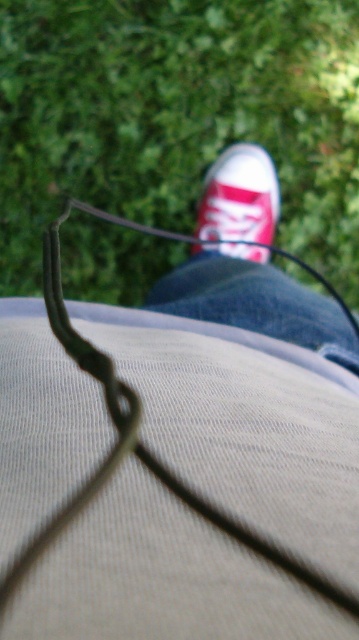
Question: Does green grass at upper center have a lesser width compared to matte canvas shoe at center?

Choices:
 (A) yes
 (B) no

Answer: (B)

Question: Which point is farther to the camera?

Choices:
 (A) matte canvas shoe at center
 (B) green grass at upper center

Answer: (B)

Question: From the image, what is the correct spatial relationship of green grass at upper center in relation to matte canvas shoe at center?

Choices:
 (A) left
 (B) right

Answer: (A)

Question: Where is green grass at upper center located in relation to matte canvas shoe at center in the image?

Choices:
 (A) below
 (B) above

Answer: (B)

Question: Among these objects, which one is nearest to the camera?

Choices:
 (A) matte canvas shoe at center
 (B) green grass at upper center

Answer: (A)